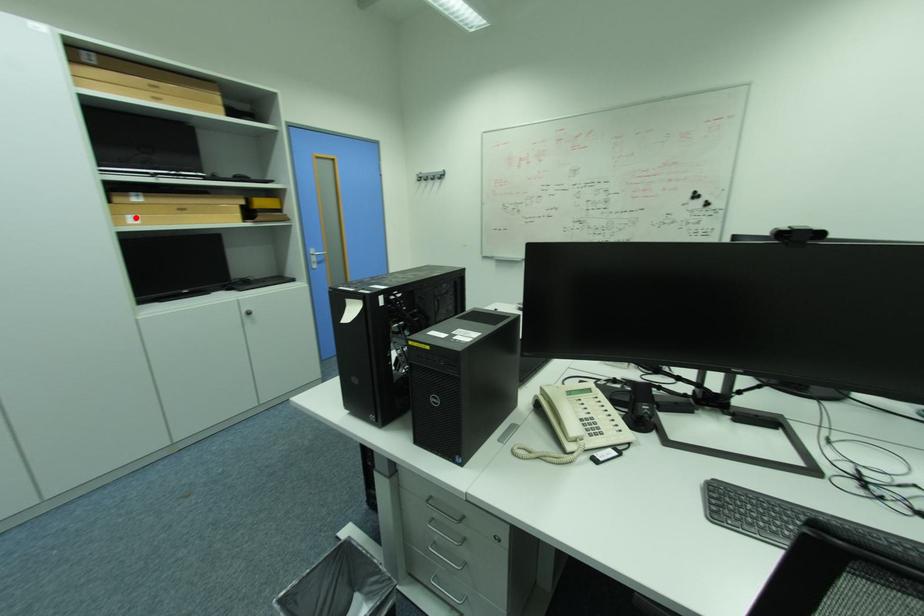
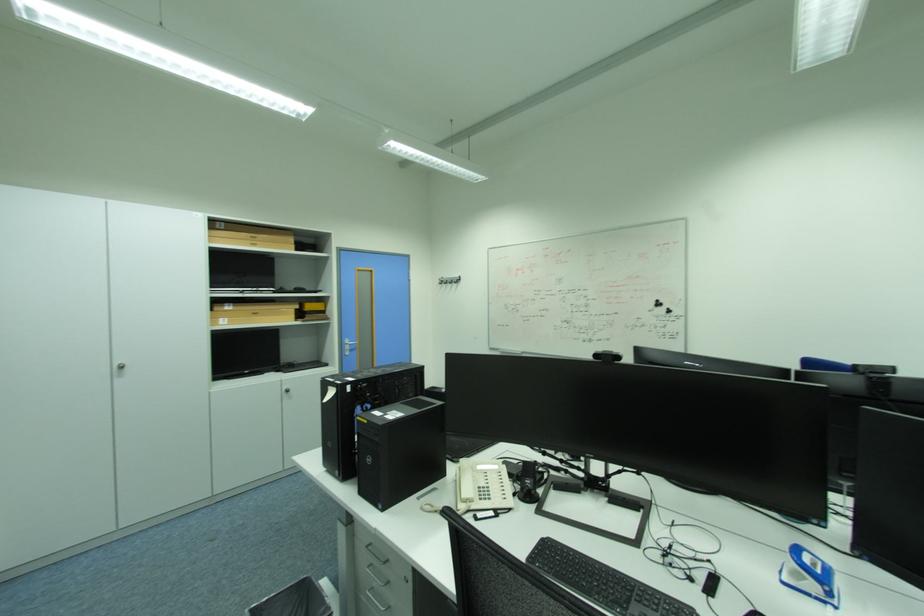
Find the pixel in the second image that matches the highlighted location in the first image.

(228, 320)